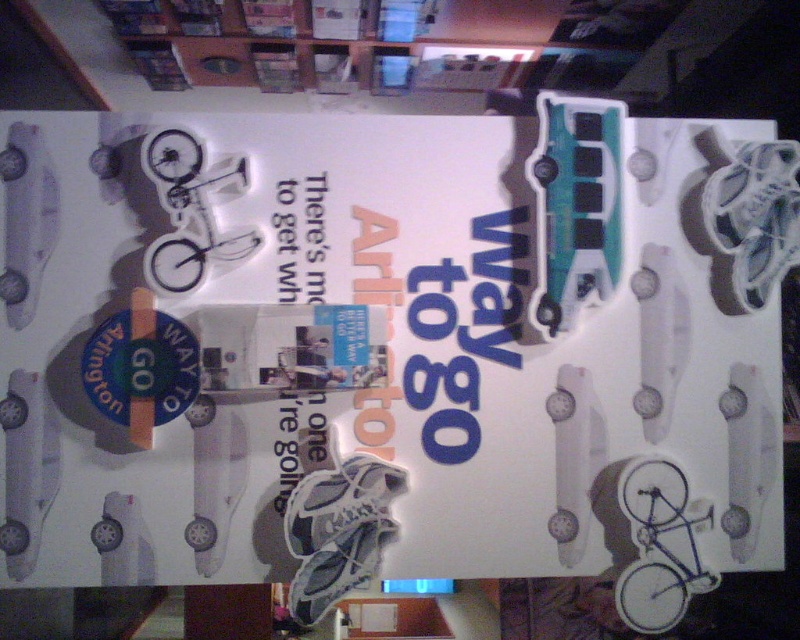
You are a graphic designer reviewing the layout of the white paper poster at center and the white paper at center. Which one is placed to the right side?

The white paper poster at center is positioned on the right side of white paper at center.

What is the spatial relationship between the white paper poster at center and the white paper at center?

The white paper poster at center is below the white paper at center.

You are standing in front of a transportation initiative poster. The white paper poster at center is 1.25 meters from you. If you want to read the text on it, will you be able to clearly see the details without moving closer?

The white paper poster at center is 1.25 meters from viewer, so yes, you can clearly see the details without moving closer as that distance is within comfortable reading range.